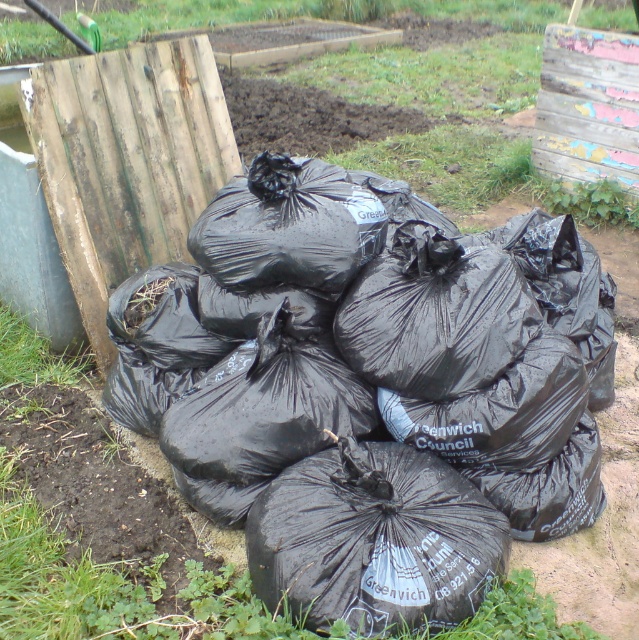
From the picture: You are a waste collector assigned to collect waste from the Greenwich Council Services. You see two items at the center of the scene, the black plastic bags at center and the black plastic sack at center. Which one is bigger in size?

The black plastic bags at center has a larger size compared to the black plastic sack at center.

You are a gardener trying to determine if the black plastic sack at center can fit into a storage bin that is as wide as the green grass at upper center. Can it fit?

The black plastic sack at center is narrower than the green grass at upper center, so it can fit into the storage bin that matches the grass width.

You are standing in the garden looking at the pile of black plastic bags. There are two points marked in the image. One is at coordinate point [332,472] and the other is at point [203,3]. Which point is closer to you?

Point [332,472] is closer to the viewer than point [203,3].